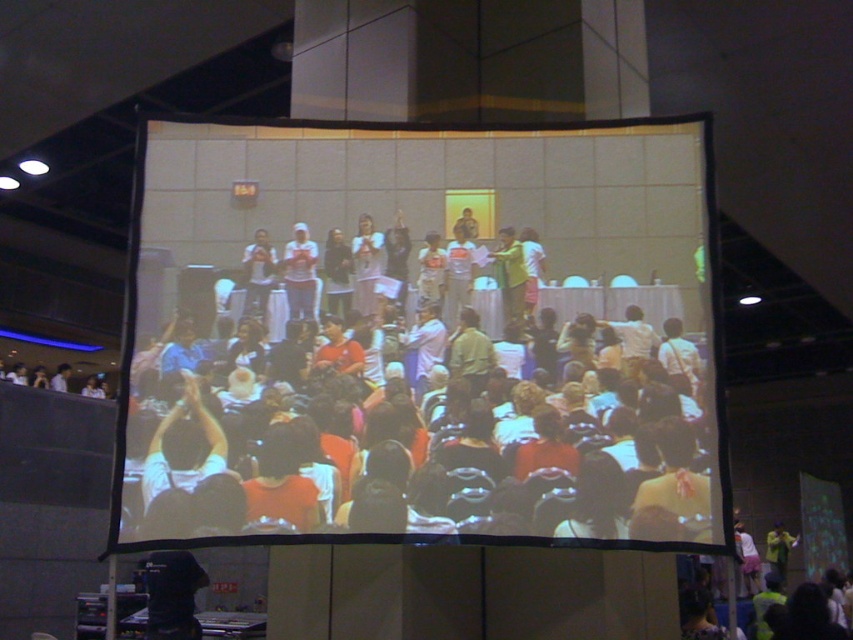
Question: Does white matte shirt at center appear over yellow fabric shirt at center?

Choices:
 (A) yes
 (B) no

Answer: (A)

Question: Does matte white screen at center have a lesser width compared to matte black shirt at center?

Choices:
 (A) no
 (B) yes

Answer: (A)

Question: Which of the following is the farthest from the observer?

Choices:
 (A) (369, 218)
 (B) (244, 276)

Answer: (A)

Question: Among these points, which one is nearest to the camera?

Choices:
 (A) (296, 182)
 (B) (248, 260)
 (C) (309, 259)

Answer: (B)

Question: Which point is closer to the camera?

Choices:
 (A) (520, 308)
 (B) (257, 232)
 (C) (572, 262)

Answer: (A)

Question: Is white matte shirt at center wider than yellow fabric shirt at center?

Choices:
 (A) no
 (B) yes

Answer: (A)